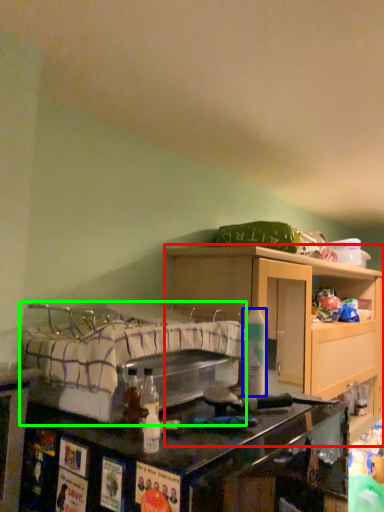
Question: Which object is positioned farthest from cabinetry (highlighted by a red box)? Select from bottle (highlighted by a blue box) and bed (highlighted by a green box).

Choices:
 (A) bottle
 (B) bed

Answer: (A)